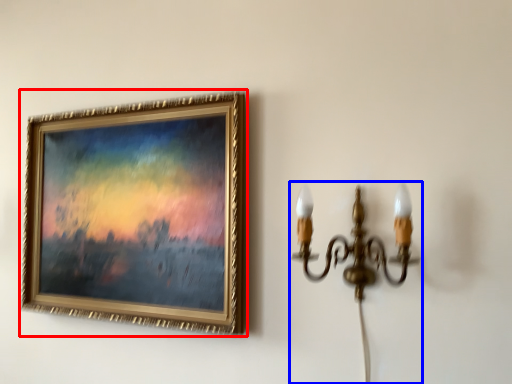
Question: Which object appears closest to the camera in this image, picture frame (highlighted by a red box) or lamp (highlighted by a blue box)?

Choices:
 (A) picture frame
 (B) lamp

Answer: (B)